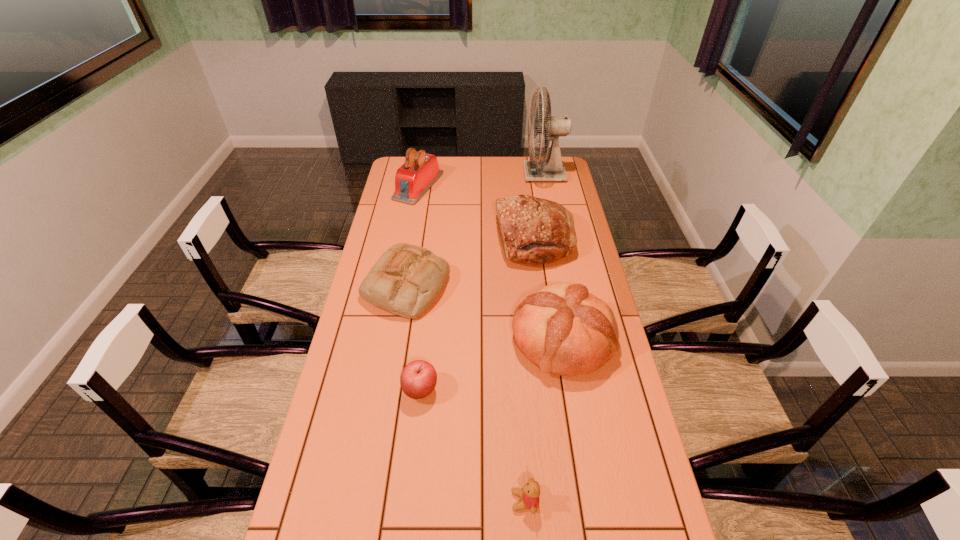
Identify the location of object present at the far left corner. The height and width of the screenshot is (540, 960). (415, 177).

Where is `object at the far right corner`? This screenshot has height=540, width=960. object at the far right corner is located at coordinates (552, 169).

Identify the location of free space at the far edge. (522, 170).

Locate an element on the screen. vacant space at the left edge is located at coordinates (351, 330).

In the image, there is a desktop. At what (x,y) coordinates should I click in order to perform the action: click on vacant space at the right edge. Please return your answer as a coordinate pair (x, y). The width and height of the screenshot is (960, 540). Looking at the image, I should click on (619, 431).

Where is `free space at the far left corner of the desktop`? free space at the far left corner of the desktop is located at coordinates point(396,160).

Find the location of a particular element. This screenshot has width=960, height=540. vacant point located between the tallest object and the shortest bread is located at coordinates (475, 230).

Identify the location of the third closest object to the nearest object. Image resolution: width=960 pixels, height=540 pixels. (406, 280).

Identify the location of object identified as the second closest to the apple. (563, 329).

This screenshot has width=960, height=540. Find the location of `bread that stands as the third closest to the apple`. bread that stands as the third closest to the apple is located at coordinates (536, 231).